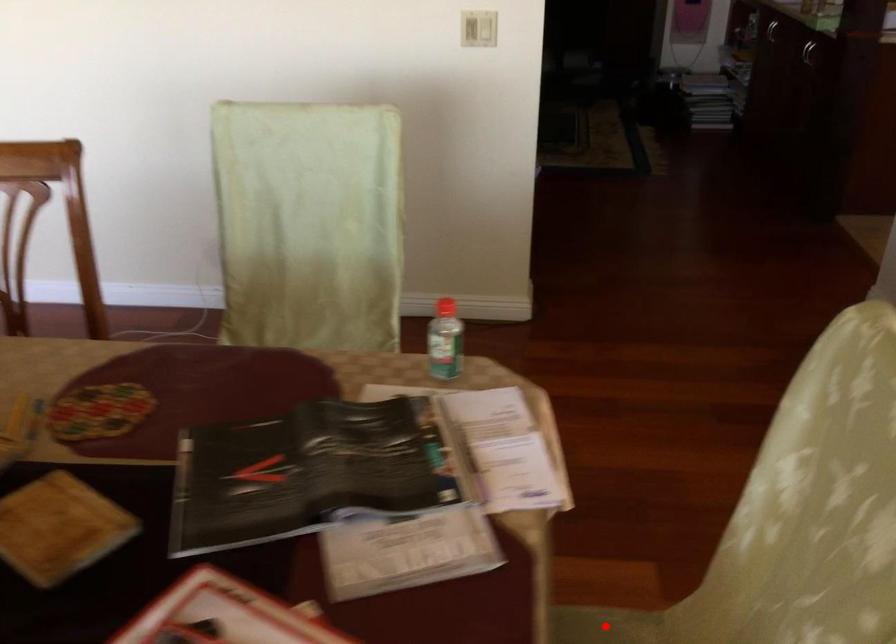
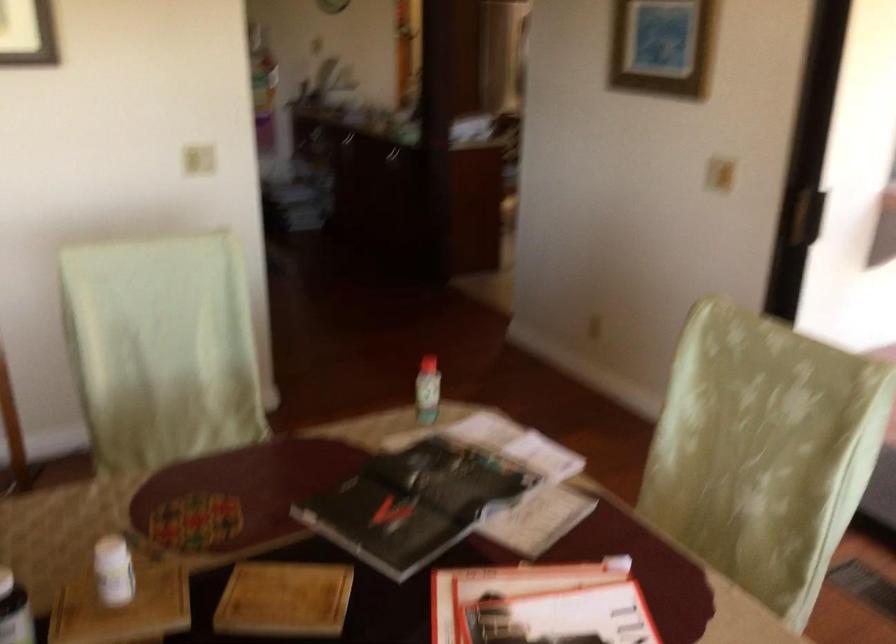
Question: I am providing you with two images of the same scene from different viewpoints. A red point is marked on the first image. At the location where the point appears in image 1, is it still visible in image 2?

Choices:
 (A) Yes
 (B) No

Answer: (B)